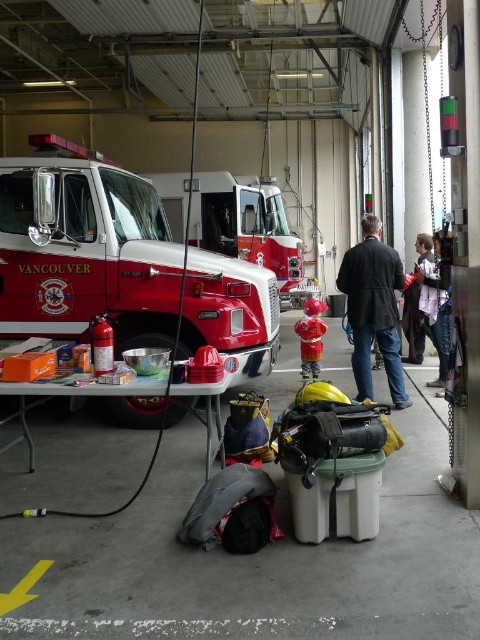
Is white cotton shirt at right further to the viewer compared to red matte fire extinguisher at left?

That is True.

In the scene shown: Does white cotton shirt at right appear under red matte fire extinguisher at left?

No.

Is point (437, 316) positioned after point (101, 369)?

Yes, it is behind point (101, 369).

Where is `white cotton shirt at right`? white cotton shirt at right is located at coordinates (432, 298).

Does dark brown leather jacket at center appear over red matte fire extinguisher at left?

Yes.

Is dark brown leather jacket at center positioned in front of red matte fire extinguisher at left?

No, it is behind red matte fire extinguisher at left.

Is point (387, 339) positioned after point (98, 332)?

That is True.

Find the location of a particular element. dark brown leather jacket at center is located at coordinates (373, 308).

Does red glossy fire truck at center appear on the right side of light brown leather jacket at right?

In fact, red glossy fire truck at center is to the left of light brown leather jacket at right.

Which is in front, point (120, 304) or point (416, 241)?

Point (120, 304)

At what (x,y) coordinates should I click in order to perform the action: click on red glossy fire truck at center. Please return your answer as a coordinate pair (x, y). Image resolution: width=480 pixels, height=640 pixels. Looking at the image, I should click on (84, 250).